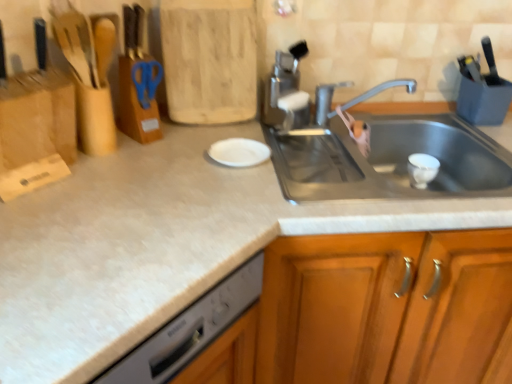
I want to click on white matte plate at center, so click(239, 152).

What do you see at coordinates (326, 102) in the screenshot? The image size is (512, 384). I see `silver metallic faucet at upper center` at bounding box center [326, 102].

Image resolution: width=512 pixels, height=384 pixels. Find the location of `satin nickel faucet at upper center`. satin nickel faucet at upper center is located at coordinates (286, 91).

Image resolution: width=512 pixels, height=384 pixels. Find the location of `white matte plate at center`. white matte plate at center is located at coordinates (239, 152).

Considering the relative sizes of satin nickel faucet at upper center and blue plastic scissors at upper center in the image provided, is satin nickel faucet at upper center thinner than blue plastic scissors at upper center?

No.

The height and width of the screenshot is (384, 512). I want to click on appliance below the blue plastic scissors at upper center (from the image's perspective), so click(x=286, y=91).

In the scene shown: Can we say satin nickel faucet at upper center lies outside blue plastic scissors at upper center?

satin nickel faucet at upper center is positioned outside blue plastic scissors at upper center.

From a real-world perspective, is satin nickel faucet at upper center over blue plastic scissors at upper center?

No, from a real-world perspective, satin nickel faucet at upper center is not on top of blue plastic scissors at upper center.

Is silver metallic faucet at upper center facing away from satin nickel faucet at upper center?

Absolutely, silver metallic faucet at upper center is directed away from satin nickel faucet at upper center.

Identify the location of tap located below the satin nickel faucet at upper center (from the image's perspective). This screenshot has height=384, width=512. (326, 102).

Considering the relative sizes of silver metallic faucet at upper center and satin nickel faucet at upper center in the image provided, is silver metallic faucet at upper center wider than satin nickel faucet at upper center?

Correct, the width of silver metallic faucet at upper center exceeds that of satin nickel faucet at upper center.

Considering the positions of objects silver metallic faucet at upper center and satin nickel faucet at upper center in the image provided, who is more to the right, silver metallic faucet at upper center or satin nickel faucet at upper center?

silver metallic faucet at upper center.

Is satin nickel faucet at upper center oriented away from wooden cabinet at center?

No, satin nickel faucet at upper center's orientation is not away from wooden cabinet at center.

Which object is wider, satin nickel faucet at upper center or wooden cabinet at center?

wooden cabinet at center is wider.

In the scene shown: From a real-world perspective, is satin nickel faucet at upper center physically above wooden cabinet at center?

Yes.

Is wooden cabinet at center not near blue plastic scissors at upper center?

No, wooden cabinet at center is not far away from blue plastic scissors at upper center.

Image resolution: width=512 pixels, height=384 pixels. Identify the location of cabinetry below the blue plastic scissors at upper center (from a real-world perspective). (384, 307).

Measure the distance from wooden cabinet at center to blue plastic scissors at upper center.

29.78 inches.

Does wooden cabinet at center have a lesser height compared to silver metallic faucet at upper center?

No.

From the image's perspective, which is below, wooden cabinet at center or silver metallic faucet at upper center?

From the image's view, wooden cabinet at center is below.

Which object is wider, wooden cabinet at center or silver metallic faucet at upper center?

With larger width is wooden cabinet at center.

Between wooden cabinet at center and silver metallic faucet at upper center, which one appears on the left side from the viewer's perspective?

silver metallic faucet at upper center.

From the image's perspective, is satin nickel faucet at upper center on top of silver metallic faucet at upper center?

Yes, from the image's perspective, satin nickel faucet at upper center is over silver metallic faucet at upper center.

Which of these two, satin nickel faucet at upper center or silver metallic faucet at upper center, is thinner?

With smaller width is satin nickel faucet at upper center.

From the picture: Does satin nickel faucet at upper center have a lesser height compared to silver metallic faucet at upper center?

Incorrect, the height of satin nickel faucet at upper center does not fall short of that of silver metallic faucet at upper center.

Does point (489, 239) appear closer or farther from the camera than point (298, 112)?

Clearly, point (489, 239) is closer to the camera than point (298, 112).

How different are the orientations of wooden cabinet at center and satin nickel faucet at upper center in degrees?

The angle between the facing direction of wooden cabinet at center and the facing direction of satin nickel faucet at upper center is 39.3 degrees.

Is wooden cabinet at center oriented away from satin nickel faucet at upper center?

No, wooden cabinet at center is not facing away from satin nickel faucet at upper center.

Considering the sizes of objects wooden cabinet at center and satin nickel faucet at upper center in the image provided, who is taller, wooden cabinet at center or satin nickel faucet at upper center?

wooden cabinet at center is taller.

Locate an element on the screen. appliance that is on the right side of blue plastic scissors at upper center is located at coordinates (286, 91).

Identify the location of appliance on the left side of silver metallic faucet at upper center. (286, 91).

Which object lies further to the anchor point satin nickel faucet at upper center, blue plastic scissors at upper center or white matte plate at center?

Based on the image, blue plastic scissors at upper center appears to be further to satin nickel faucet at upper center.

When comparing their distances from white matte plate at center, does wooden cabinet at center or satin nickel faucet at upper center seem closer?

satin nickel faucet at upper center is closer to white matte plate at center.

Estimate the real-world distances between objects in this image. Which object is closer to blue plastic scissors at upper center, white matte plate at center or satin nickel faucet at upper center?

white matte plate at center is positioned closer to the anchor blue plastic scissors at upper center.

When comparing their distances from silver metallic faucet at upper center, does wooden cabinet at center or satin nickel faucet at upper center seem further?

Based on the image, wooden cabinet at center appears to be further to silver metallic faucet at upper center.

From the image, which object appears to be farther from wooden cabinet at center, blue plastic scissors at upper center or satin nickel faucet at upper center?

blue plastic scissors at upper center is positioned further to the anchor wooden cabinet at center.

Considering their positions, is blue plastic scissors at upper center positioned further to wooden cabinet at center than white matte plate at center?

Among the two, blue plastic scissors at upper center is located further to wooden cabinet at center.

When comparing their distances from wooden cabinet at center, does white matte plate at center or satin nickel faucet at upper center seem further?

Among the two, satin nickel faucet at upper center is located further to wooden cabinet at center.

From the image, which object appears to be farther from white matte plate at center, satin nickel faucet at upper center or blue plastic scissors at upper center?

blue plastic scissors at upper center is further to white matte plate at center.

The width and height of the screenshot is (512, 384). What are the coordinates of `tap between satin nickel faucet at upper center and wooden cabinet at center in the vertical direction` in the screenshot? It's located at (326, 102).

Locate an element on the screen. appliance located between white matte plate at center and wooden cabinet at center in the left-right direction is located at coordinates click(286, 91).

You are a GUI agent. You are given a task and a screenshot of the screen. Output one action in this format:
    pyautogui.click(x=<x>, y=<y>)
    Task: Click on the appliance located between blue plastic scissors at upper center and wooden cabinet at center in the left-right direction
    The width and height of the screenshot is (512, 384).
    Given the screenshot: What is the action you would take?
    pyautogui.click(x=286, y=91)

Where is `plate between blue plastic scissors at upper center and wooden cabinet at center from left to right`? The width and height of the screenshot is (512, 384). plate between blue plastic scissors at upper center and wooden cabinet at center from left to right is located at coordinates point(239,152).